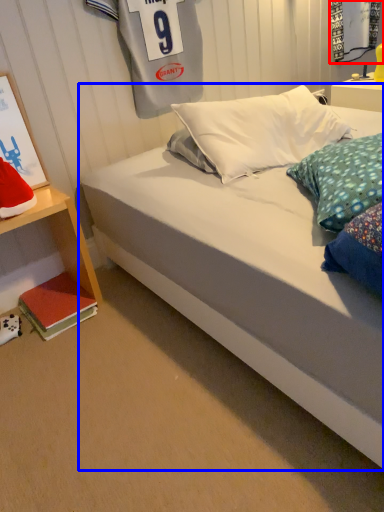
Question: Which of the following is the closest to the observer, shop window (highlighted by a red box) or bed (highlighted by a blue box)?

Choices:
 (A) shop window
 (B) bed

Answer: (B)